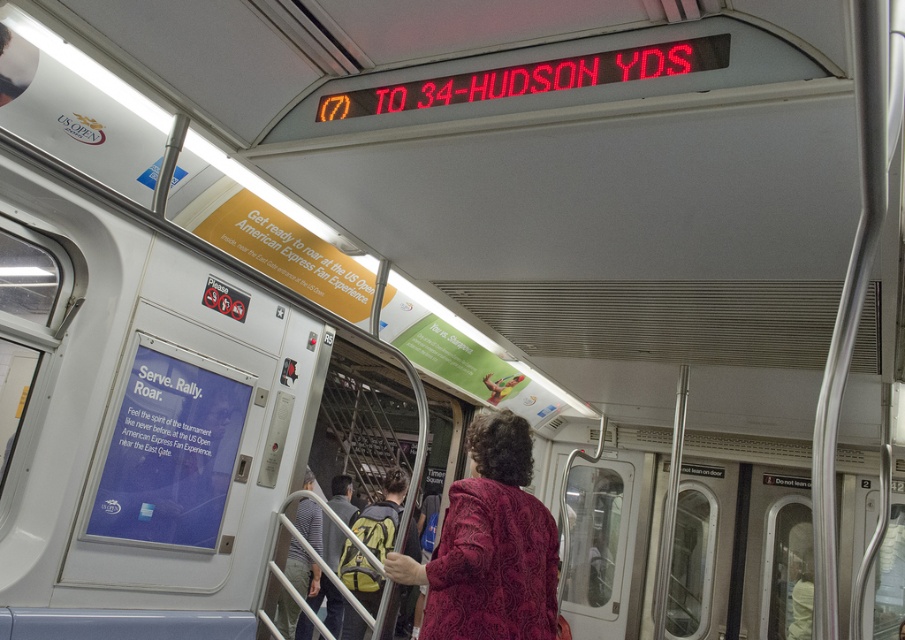
Question: Which point appears farthest from the camera in this image?

Choices:
 (A) pos(313,509)
 (B) pos(417,540)
 (C) pos(507,625)

Answer: (B)

Question: Among these points, which one is farthest from the camera?

Choices:
 (A) (351, 636)
 (B) (296, 557)
 (C) (505, 412)

Answer: (B)

Question: Which object is the closest to the green backpack at center?

Choices:
 (A) velvet burgundy coat at center
 (B) striped fabric coach at center

Answer: (B)

Question: Where is velvet burgundy coat at center located in relation to green backpack at center in the image?

Choices:
 (A) left
 (B) right

Answer: (B)

Question: Is green backpack at center positioned before striped fabric coach at center?

Choices:
 (A) yes
 (B) no

Answer: (A)

Question: Is velvet burgundy coat at center positioned behind green backpack at center?

Choices:
 (A) yes
 (B) no

Answer: (B)